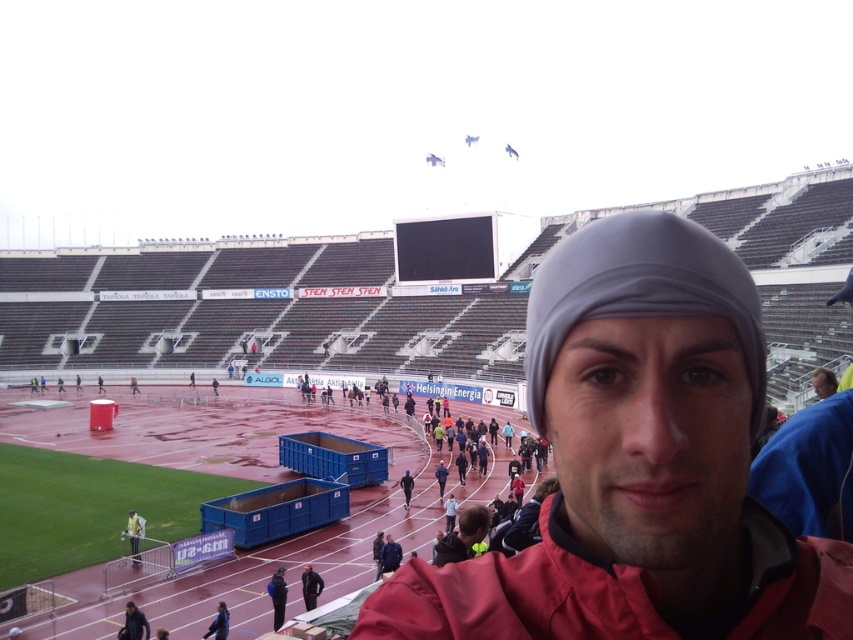
Question: Is red matte jacket at center thinner than dark blue jacket at lower left?

Choices:
 (A) yes
 (B) no

Answer: (B)

Question: Can you confirm if red jacket at lower center is thinner than dark blue jacket at lower left?

Choices:
 (A) no
 (B) yes

Answer: (A)

Question: Based on their relative distances, which object is farther from the red matte jacket at center?

Choices:
 (A) black matte jacket at lower center
 (B) dark blue jacket at lower left

Answer: (A)

Question: Which point is farther to the camera?

Choices:
 (A) dark blue jacket at lower left
 (B) red matte jacket at center
 (C) red jacket at lower center
 (D) black matte jacket at lower center

Answer: (D)

Question: Where is red matte jacket at center located in relation to black matte jacket at lower center in the image?

Choices:
 (A) left
 (B) right

Answer: (B)

Question: Estimate the real-world distances between objects in this image. Which object is closer to the red matte jacket at center?

Choices:
 (A) black matte jacket at lower center
 (B) dark blue jacket at lower left
 (C) red jacket at lower center

Answer: (C)